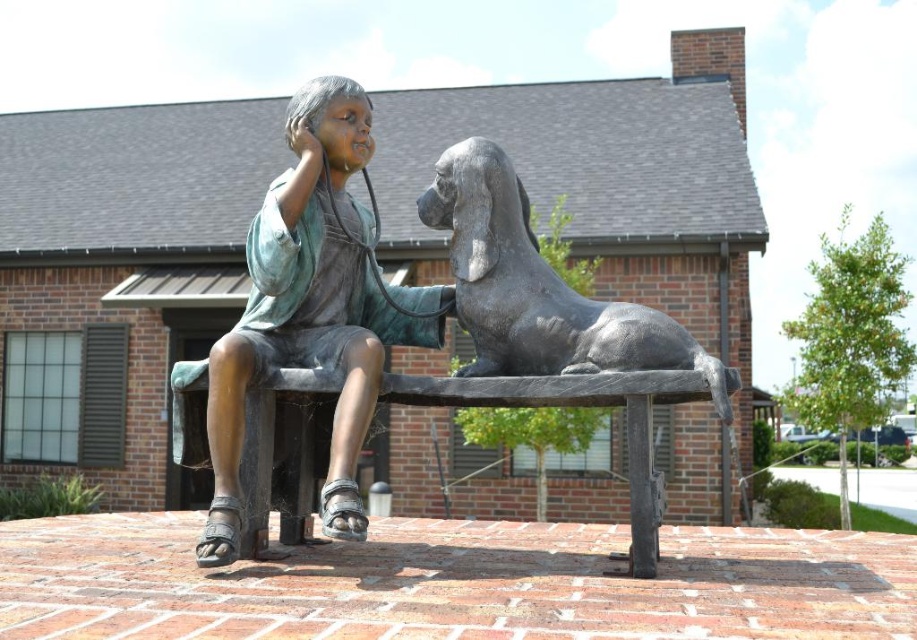
Question: Which point is farther to the camera?

Choices:
 (A) bronze statue of dog at center
 (B) bronze statue of child at center
 (C) bronze bench at center

Answer: (C)

Question: Is bronze statue of child at center to the left of bronze bench at center from the viewer's perspective?

Choices:
 (A) no
 (B) yes

Answer: (B)

Question: Which point is closer to the camera taking this photo?

Choices:
 (A) (350, 173)
 (B) (260, 433)
 (C) (473, 272)

Answer: (B)

Question: Does bronze statue of child at center appear under bronze statue of dog at center?

Choices:
 (A) yes
 (B) no

Answer: (A)

Question: Where is bronze statue of dog at center located in relation to bronze bench at center in the image?

Choices:
 (A) right
 (B) left

Answer: (A)

Question: Which of these objects is positioned farthest from the bronze statue of child at center?

Choices:
 (A) bronze bench at center
 (B) bronze statue of dog at center

Answer: (B)